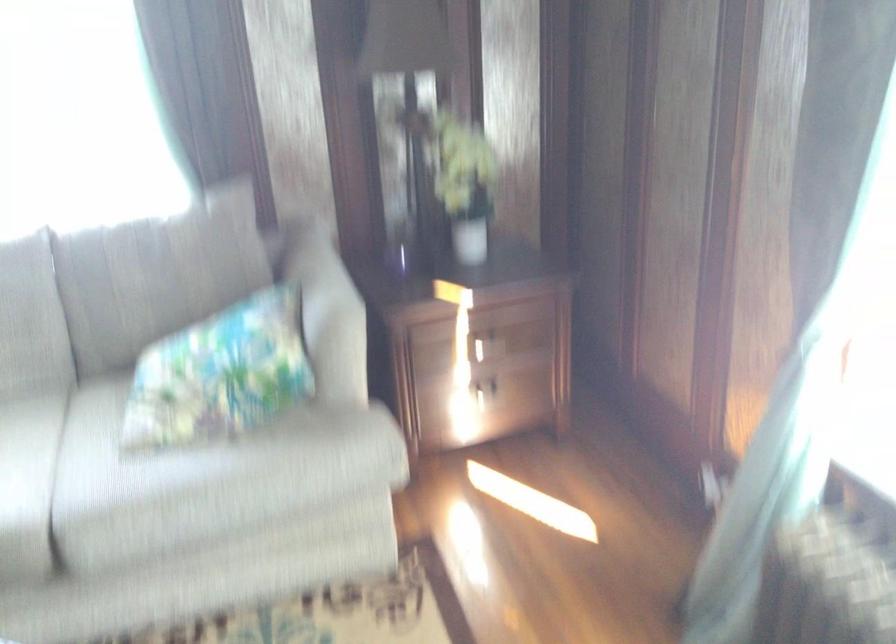
The image size is (896, 644). Describe the element at coordinates (326, 296) in the screenshot. I see `the sofa armrest` at that location.